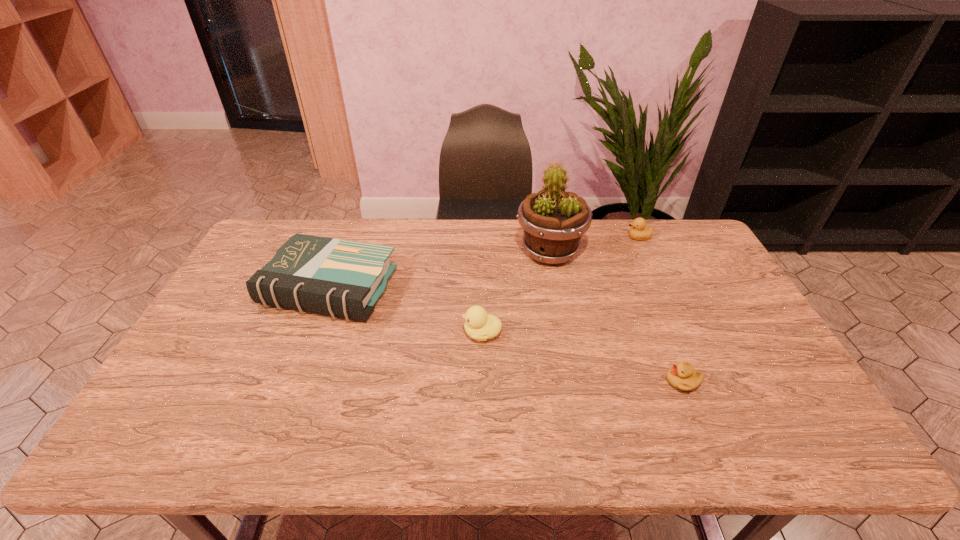
Identify the location of vacant space situated on the front of the paperback book. The width and height of the screenshot is (960, 540). (277, 426).

The height and width of the screenshot is (540, 960). I want to click on vacant space positioned at the beak of the second object from left to right, so click(x=341, y=333).

Identify the location of free space located at the beak of the second object from left to right. (401, 333).

Locate an element on the screen. vacant space located 0.350m at the beak of the second object from left to right is located at coordinates (338, 333).

Find the location of a particular element. Image resolution: width=960 pixels, height=540 pixels. free space located 0.070m facing forward on the farthest duckling is located at coordinates (607, 238).

This screenshot has width=960, height=540. I want to click on vacant space located 0.170m facing forward on the farthest duckling, so coord(579,238).

Where is `vacant space located 0.390m facing forward on the farthest duckling`? Image resolution: width=960 pixels, height=540 pixels. vacant space located 0.390m facing forward on the farthest duckling is located at coordinates (517, 238).

You are a GUI agent. You are given a task and a screenshot of the screen. Output one action in this format:
    pyautogui.click(x=<x>, y=<y>)
    Task: Click on the free space located 0.070m on the front-facing side of the nearest duckling
    This screenshot has height=540, width=960.
    Given the screenshot: What is the action you would take?
    pyautogui.click(x=638, y=381)

This screenshot has width=960, height=540. In order to click on free space located on the front-facing side of the nearest duckling in this screenshot , I will do `click(551, 381)`.

This screenshot has width=960, height=540. Identify the location of blank space located 0.140m on the front-facing side of the nearest duckling. (611, 381).